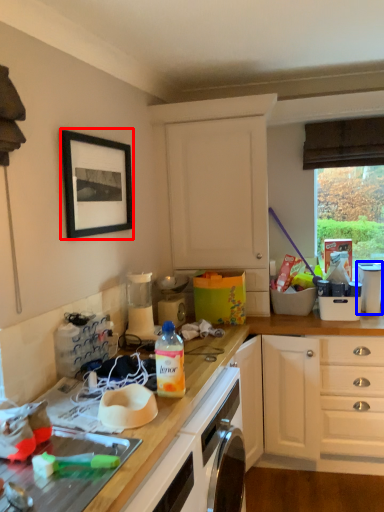
Question: Which point is further to the camera, picture frame (highlighted by a red box) or appliance (highlighted by a blue box)?

Choices:
 (A) picture frame
 (B) appliance

Answer: (B)